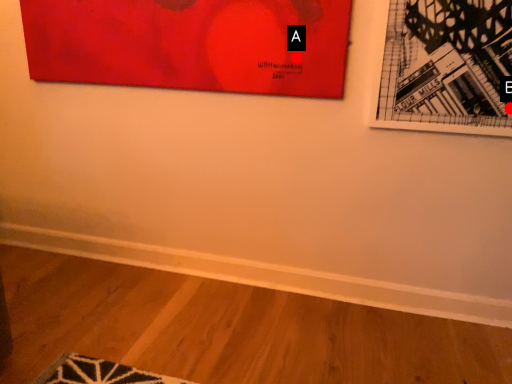
Question: Two points are circled on the image, labeled by A and B beside each circle. Which point appears farthest from the camera in this image?

Choices:
 (A) A is further
 (B) B is further

Answer: (A)